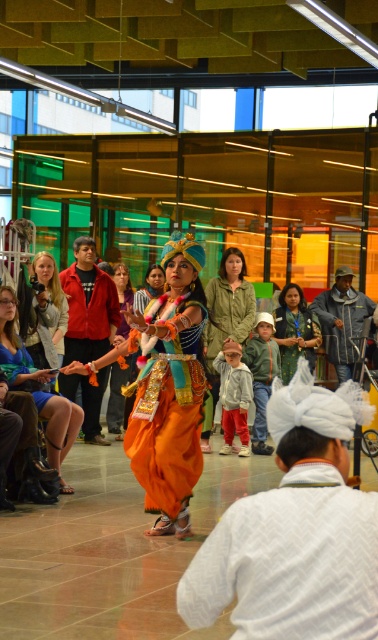
You are a stagehand preparing for a performance. You need to place a 3.5 meter long decorative banner between the orange satin dress at center and the orange fabric at center. Will the banner fit between them?

The orange satin dress at center and orange fabric at center are 5.25 meters apart. Since the banner is 3.5 meters long, it will fit between them with 1.75 meters of space remaining.

You are a photographer setting up for a cultural performance. You notice the orange satin dress at center and the orange fabric at center in the scene. Which object is closer to the camera?

The orange satin dress at center is positioned over orange fabric at center, meaning it is closer to the camera.

You are a photographer at the event and want to capture a photo where both the white textured turban at lower center and the matte blue dress at center are visible. Since the dress is taller, will the turban be hidden behind it?

The white textured turban at lower center is shorter than the matte blue dress at center, so the turban might be partially or fully hidden behind the dress in the photo.